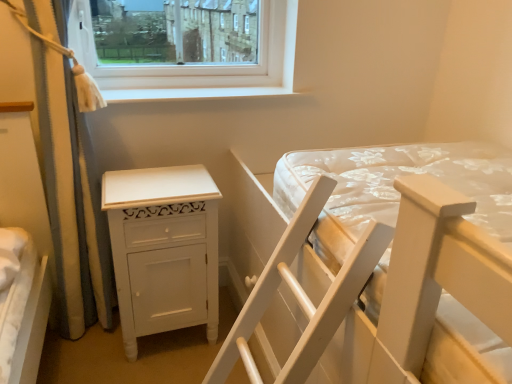
Where is `white textured curtain at left`? The image size is (512, 384). white textured curtain at left is located at coordinates (63, 176).

Identify the location of white painted wood nightstand at lower left. The image size is (512, 384). (163, 249).

At what (x,y) coordinates should I click in order to perform the action: click on white wooden bed at center. Please return your answer as a coordinate pair (x, y). Looking at the image, I should click on (370, 201).

Is the surface of white smooth window sill at upper center in direct contact with white textured curtain at left?

white smooth window sill at upper center is not next to white textured curtain at left, and they're not touching.

Is white smooth window sill at upper center positioned beyond the bounds of white textured curtain at left?

Yes.

Considering the points (256, 91) and (17, 89), which point is behind, point (256, 91) or point (17, 89)?

The point (256, 91) is behind.

From the image's perspective, is white smooth window sill at upper center above or below white textured curtain at left?

From the image's perspective, white smooth window sill at upper center appears above white textured curtain at left.

Are white smooth window sill at upper center and white wooden bed at center making contact?

There is a gap between white smooth window sill at upper center and white wooden bed at center.

In the scene shown: Considering the positions of objects white smooth window sill at upper center and white wooden bed at center in the image provided, who is in front, white smooth window sill at upper center or white wooden bed at center?

Positioned in front is white wooden bed at center.

Is white smooth window sill at upper center at the left side of white wooden bed at center?

Correct, you'll find white smooth window sill at upper center to the left of white wooden bed at center.

Considering the relative sizes of white wooden bed at center and white smooth window sill at upper center in the image provided, is white wooden bed at center smaller than white smooth window sill at upper center?

Incorrect, white wooden bed at center is not smaller in size than white smooth window sill at upper center.

From a real-world perspective, which object rests below the other?

white wooden bed at center, from a real-world perspective.

Is white wooden bed at center further to camera compared to white smooth window sill at upper center?

No, it is in front of white smooth window sill at upper center.

From their relative heights in the image, would you say white textured curtain at left is taller or shorter than white painted wood nightstand at lower left?

In the image, white textured curtain at left appears to be taller than white painted wood nightstand at lower left.

Consider the image. From the image's perspective, is white textured curtain at left positioned above or below white painted wood nightstand at lower left?

From the image's perspective, white textured curtain at left appears above white painted wood nightstand at lower left.

Can you confirm if white textured curtain at left is smaller than white painted wood nightstand at lower left?

No, white textured curtain at left is not smaller than white painted wood nightstand at lower left.

Is white textured curtain at left facing towards white painted wood nightstand at lower left?

Yes.

Is white smooth window sill at upper center positioned before white painted wood nightstand at lower left?

No, the depth of white smooth window sill at upper center is greater than that of white painted wood nightstand at lower left.

Considering the sizes of objects white smooth window sill at upper center and white painted wood nightstand at lower left in the image provided, who is thinner, white smooth window sill at upper center or white painted wood nightstand at lower left?

white smooth window sill at upper center is thinner.

Find the location of a particular element. The height and width of the screenshot is (384, 512). window sill above the white painted wood nightstand at lower left (from a real-world perspective) is located at coordinates (192, 94).

Which point is more forward, (186, 98) or (102, 198)?

The point (102, 198) is closer to the camera.

From a real-world perspective, is white textured curtain at left above or below white smooth window sill at upper center?

white textured curtain at left is below white smooth window sill at upper center.

Is white textured curtain at left not inside white smooth window sill at upper center?

That's correct, white textured curtain at left is outside of white smooth window sill at upper center.

Is white textured curtain at left in front of or behind white smooth window sill at upper center in the image?

white textured curtain at left is positioned closer to the viewer than white smooth window sill at upper center.

In terms of size, does white textured curtain at left appear bigger or smaller than white smooth window sill at upper center?

Considering their sizes, white textured curtain at left takes up more space than white smooth window sill at upper center.

In the image, is white painted wood nightstand at lower left positioned in front of or behind white wooden bed at center?

white painted wood nightstand at lower left is behind white wooden bed at center.

The width and height of the screenshot is (512, 384). Identify the location of bed above the white painted wood nightstand at lower left (from a real-world perspective). (370, 201).

Would you say white painted wood nightstand at lower left is outside white wooden bed at center?

white painted wood nightstand at lower left lies outside white wooden bed at center's area.

Considering the points (202, 272) and (475, 213), which point is behind, point (202, 272) or point (475, 213)?

The point (202, 272) is behind.

This screenshot has width=512, height=384. I want to click on curtain that is on the left side of white smooth window sill at upper center, so click(x=63, y=176).

At what (x,y) coordinates should I click in order to perform the action: click on bed on the right of white smooth window sill at upper center. Please return your answer as a coordinate pair (x, y). The image size is (512, 384). Looking at the image, I should click on (370, 201).

When comparing their distances from white wooden bed at center, does white smooth window sill at upper center or white textured curtain at left seem closer?

white smooth window sill at upper center is closer to white wooden bed at center.

Considering their positions, is white wooden bed at center positioned closer to white painted wood nightstand at lower left than white smooth window sill at upper center?

white wooden bed at center lies closer to white painted wood nightstand at lower left than the other object.

Which object lies further to the anchor point white wooden bed at center, white painted wood nightstand at lower left or white textured curtain at left?

Among the two, white textured curtain at left is located further to white wooden bed at center.

When comparing their distances from white wooden bed at center, does white textured curtain at left or white painted wood nightstand at lower left seem further?

white textured curtain at left.

Considering their positions, is white smooth window sill at upper center positioned further to white wooden bed at center than white painted wood nightstand at lower left?

The object further to white wooden bed at center is white smooth window sill at upper center.

Looking at the image, which one is located closer to white textured curtain at left, white painted wood nightstand at lower left or white smooth window sill at upper center?

white painted wood nightstand at lower left.

From the image, which object appears to be farther from white wooden bed at center, white textured curtain at left or white smooth window sill at upper center?

white textured curtain at left lies further to white wooden bed at center than the other object.

Considering their positions, is white wooden bed at center positioned further to white painted wood nightstand at lower left than white textured curtain at left?

white wooden bed at center lies further to white painted wood nightstand at lower left than the other object.

Where is `nightstand between white wooden bed at center and white smooth window sill at upper center along the z-axis`? This screenshot has width=512, height=384. nightstand between white wooden bed at center and white smooth window sill at upper center along the z-axis is located at coordinates (163, 249).

You are a GUI agent. You are given a task and a screenshot of the screen. Output one action in this format:
    pyautogui.click(x=<x>, y=<y>)
    Task: Click on the curtain between white smooth window sill at upper center and white painted wood nightstand at lower left from top to bottom
    The width and height of the screenshot is (512, 384).
    Given the screenshot: What is the action you would take?
    pyautogui.click(x=63, y=176)

What are the coordinates of `window sill between white textured curtain at left and white wooden bed at center from left to right` in the screenshot? It's located at (192, 94).

Identify the location of nightstand between white textured curtain at left and white wooden bed at center in the horizontal direction. (163, 249).